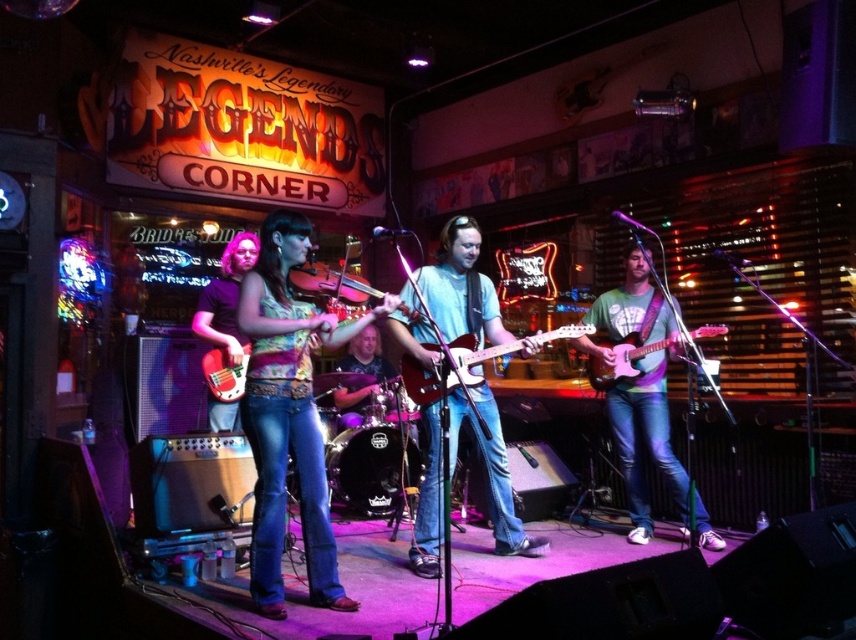
You are a photographer trying to capture a closeup of the shiny purple drum set at center without the matte red guitar at center blocking the view. Can you position yourself in front of the stage to achieve this?

The matte red guitar at center is behind the shiny purple drum set at center, so positioning yourself in front of the stage would allow you to capture the shiny purple drum set at center without obstruction from the matte red guitar at center.

You are a photographer at the venue and need to position a spotlight exactly at the center of the stage. The stage has a coordinate system where the bottom left corner is the origin. The multicolored fabric top at center is currently at point (288, 413). Is the spotlight positioned to the left or right of the multicolored fabric top at center?

The spotlight is positioned to the right of the multicolored fabric top at center because the x coordinate of the spotlight is 0.648, which is greater than 0.5. Since the coordinate system starts at the bottom left corner, higher x values indicate positions further to the right.